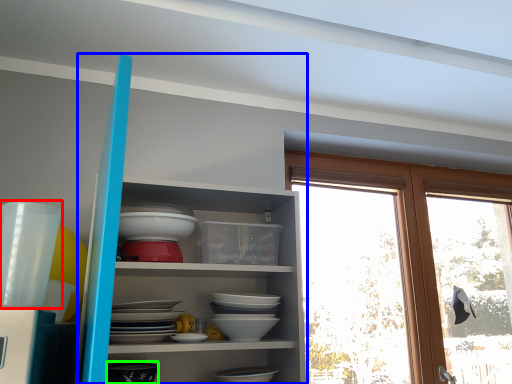
Question: Estimate the real-world distances between objects in this image. Which object is closer to tableware (highlighted by a red box), shelf (highlighted by a blue box) or tableware (highlighted by a green box)?

Choices:
 (A) shelf
 (B) tableware

Answer: (B)